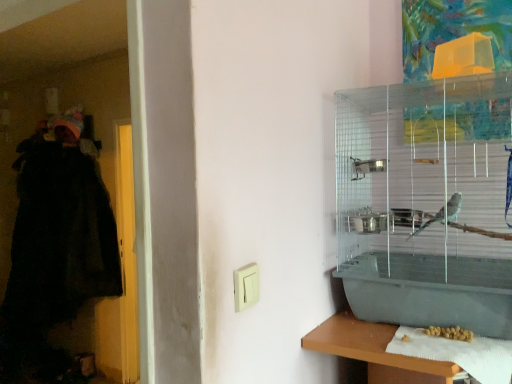
Image resolution: width=512 pixels, height=384 pixels. Identify the location of vacant area on top of white paper towel at lower right (from a real-world perspective). (444, 334).